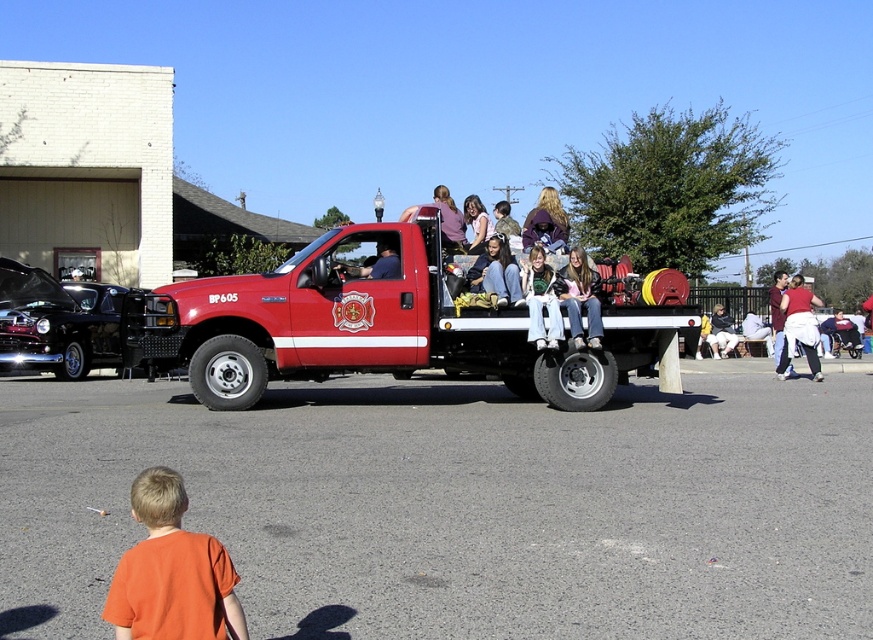
You are standing in front of the red fire truck BP 605 at the event. There are two points marked on the truck bed where people are sitting. The first point is at coordinates (x=251, y=364) and the second at (x=568, y=264). If you want to place a small flag closer to the front of the truck bed, which point should you choose?

Point (x=251, y=364) is closer to the viewer than point (x=568, y=264). Therefore, placing the flag at point (x=251, y=364) would position it closer to the front of the truck bed.